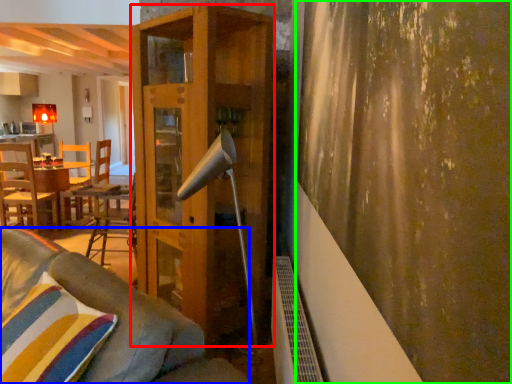
Question: Which object is the farthest from shelf (highlighted by a red box)? Choose among these: studio couch (highlighted by a blue box) or curtain (highlighted by a green box).

Choices:
 (A) studio couch
 (B) curtain

Answer: (B)